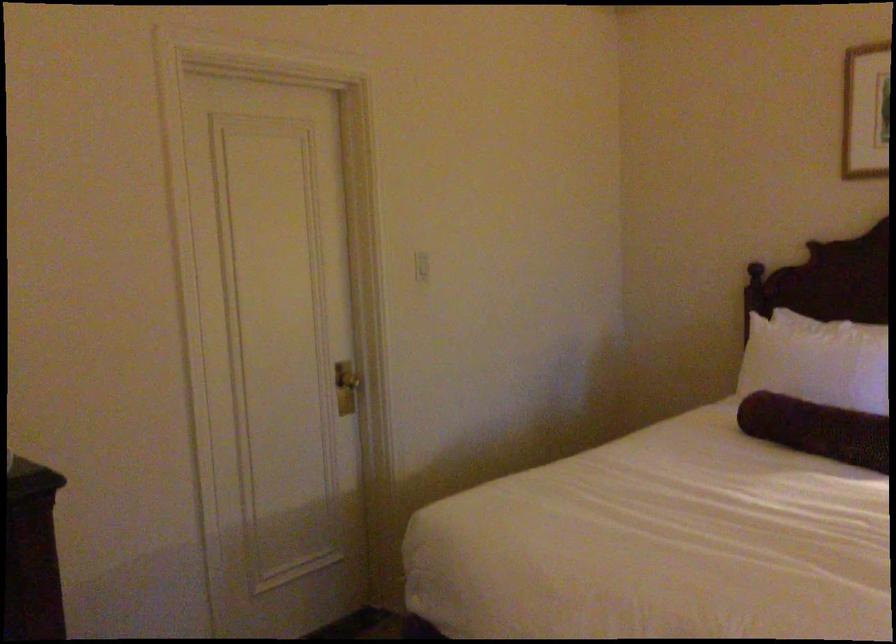
Where would you lift the white pillow? Please return your answer as a coordinate pair (x, y).

(812, 357)